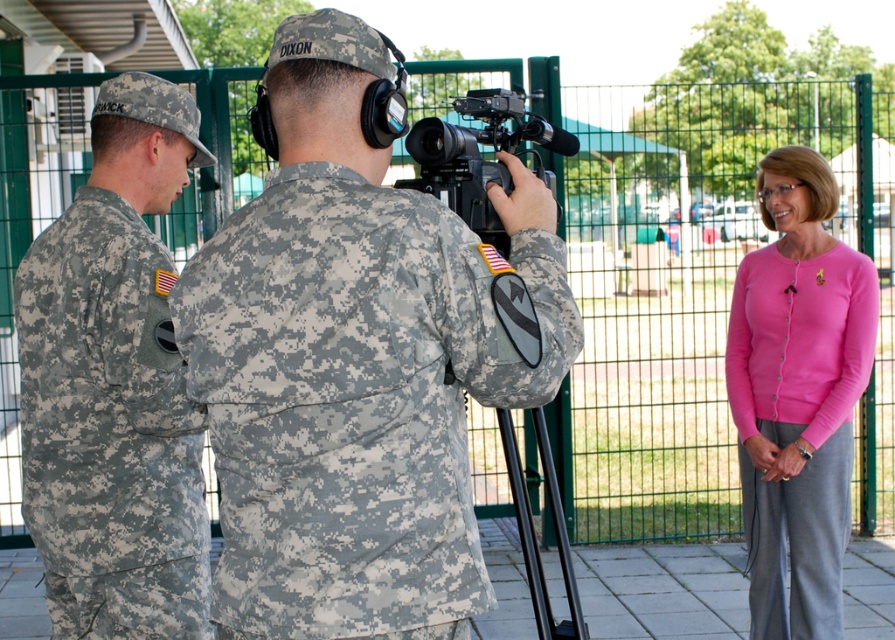
Question: Considering the real-world distances, which object is farthest from the camouflage uniform at center?

Choices:
 (A) black plastic camera at center
 (B) pink cardigan at right

Answer: (B)

Question: Can you confirm if camouflage uniform at center is smaller than pink cardigan at right?

Choices:
 (A) no
 (B) yes

Answer: (B)

Question: Which of the following is the farthest from the observer?

Choices:
 (A) camouflage uniform at center
 (B) black plastic camera at center
 (C) camouflage fabric uniform at left

Answer: (C)

Question: Among these objects, which one is farthest from the camera?

Choices:
 (A) camouflage uniform at center
 (B) black plastic camera at center
 (C) pink cardigan at right
 (D) camouflage fabric uniform at left

Answer: (C)

Question: From the image, what is the correct spatial relationship of camouflage fabric uniform at left in relation to pink cardigan at right?

Choices:
 (A) left
 (B) right

Answer: (A)

Question: Can you confirm if pink cardigan at right is thinner than black plastic camera at center?

Choices:
 (A) no
 (B) yes

Answer: (A)